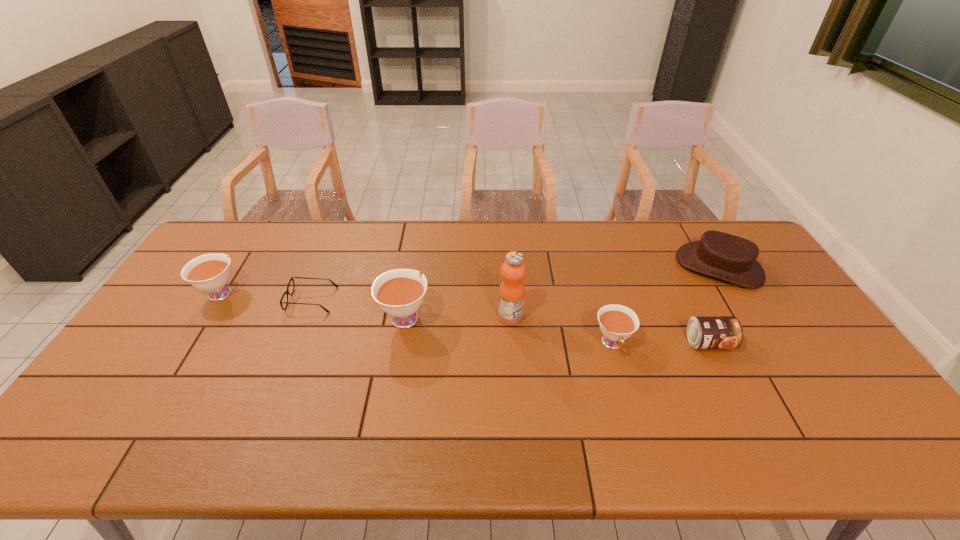
Find the location of a particular element. Image resolution: width=960 pixels, height=540 pixels. free point that satisfies the following two spatial constraints: 1. with the lenses facing outward on the fruit juice; 2. on the left side of the sixth object from right to left is located at coordinates (305, 317).

Locate an element on the screen. Image resolution: width=960 pixels, height=540 pixels. vacant point that satisfies the following two spatial constraints: 1. with the lenses facing outward on the fourth object from left to right; 2. on the left side of the spectacles is located at coordinates (305, 317).

Locate an element on the screen. Image resolution: width=960 pixels, height=540 pixels. free spot that satisfies the following two spatial constraints: 1. with the lenses facing outward on the shortest object; 2. on the side of the third object from left to right with the handle is located at coordinates (305, 316).

I want to click on free point that satisfies the following two spatial constraints: 1. with the lenses facing outward on the tallest object; 2. on the right side of the shortest object, so click(x=305, y=317).

Identify the location of vacant position in the image that satisfies the following two spatial constraints: 1. with the lenses facing outward on the shortest object; 2. on the right side of the tallest object. (305, 317).

The width and height of the screenshot is (960, 540). Identify the location of free point that satisfies the following two spatial constraints: 1. on the side of the second teacup from left to right with the handle; 2. with the lenses facing outward on the sixth object from right to left. (408, 300).

In order to click on vacant space that satisfies the following two spatial constraints: 1. on the side of the hat with the handle; 2. on the right side of the fifth object from right to left in this screenshot , I will do `click(414, 267)`.